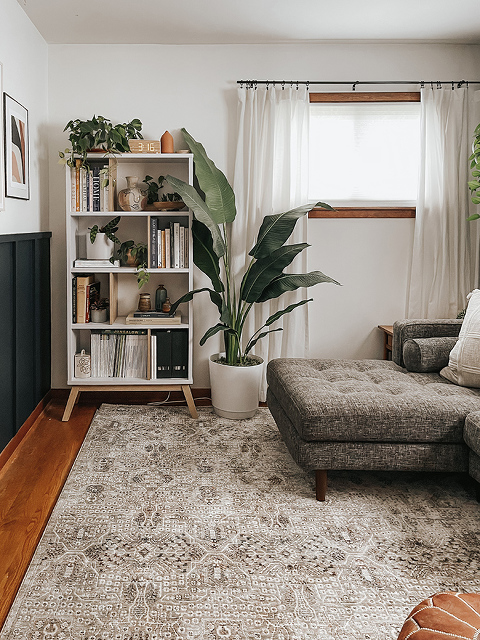
Image resolution: width=480 pixels, height=640 pixels. What are the coordinates of `vase` in the screenshot? It's located at (133, 195).